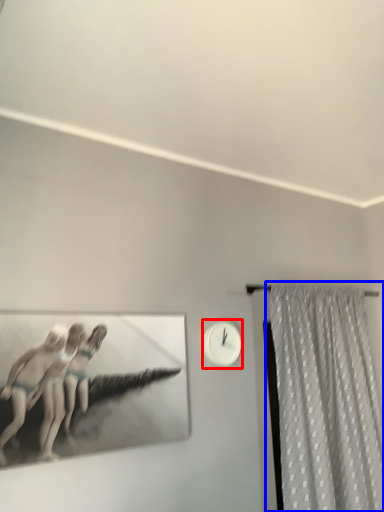
Question: Which point is further to the camera, clock (highlighted by a red box) or curtain (highlighted by a blue box)?

Choices:
 (A) clock
 (B) curtain

Answer: (A)